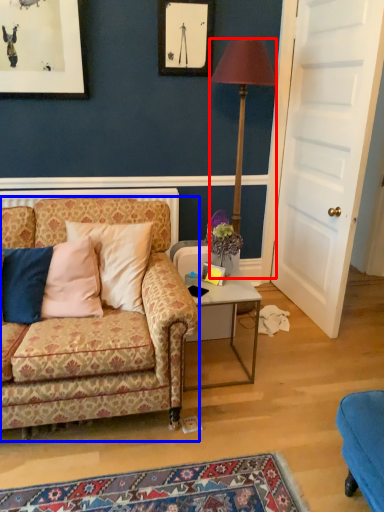
Question: Which object is closer to the camera taking this photo, lamp (highlighted by a red box) or studio couch (highlighted by a blue box)?

Choices:
 (A) lamp
 (B) studio couch

Answer: (B)